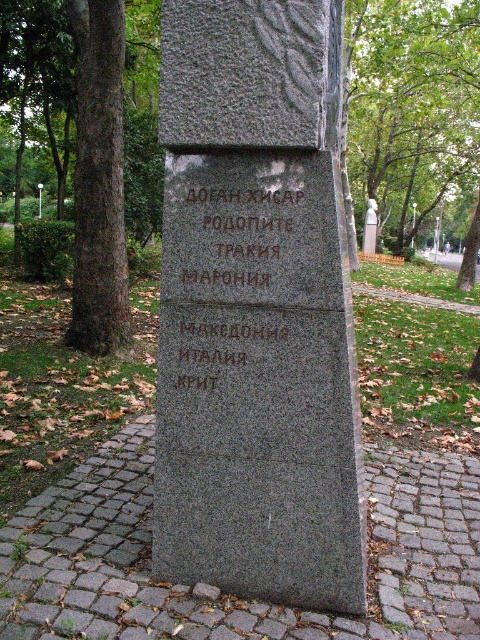
Consider the image. You are planning to take a photo of the granite stone monument at center and the brown textured tree trunk at left. Which object should you focus on first if you want to include both in the frame without moving the camera?

You should focus on the granite stone monument at center first because it is wider than the brown textured tree trunk at left, so it requires a wider angle to capture both in the frame.

You are standing in front of a monument in a park and see both the black granite stone at center and the sanded stone statue at center. Which object is nearer to you?

The black granite stone at center is closer to the viewer than the sanded stone statue at center.